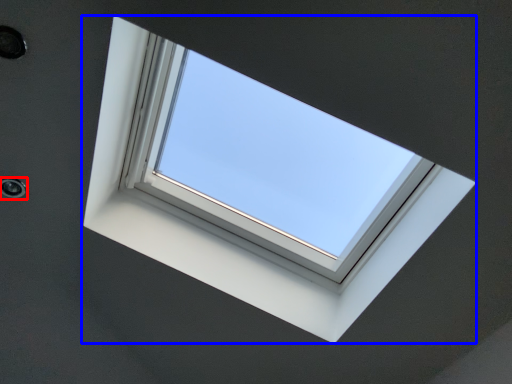
Question: Which object appears closest to the camera in this image, hole (highlighted by a red box) or window (highlighted by a blue box)?

Choices:
 (A) hole
 (B) window

Answer: (B)